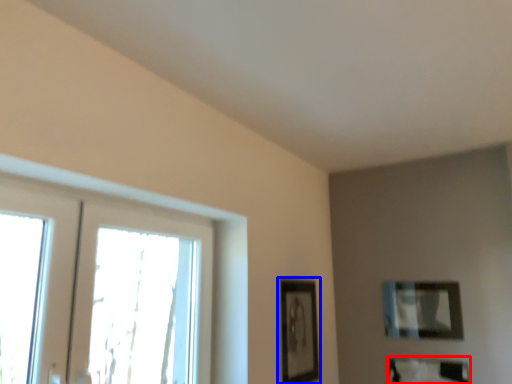
Question: Which object is closer to the camera taking this photo, picture frame (highlighted by a red box) or picture frame (highlighted by a blue box)?

Choices:
 (A) picture frame
 (B) picture frame

Answer: (B)